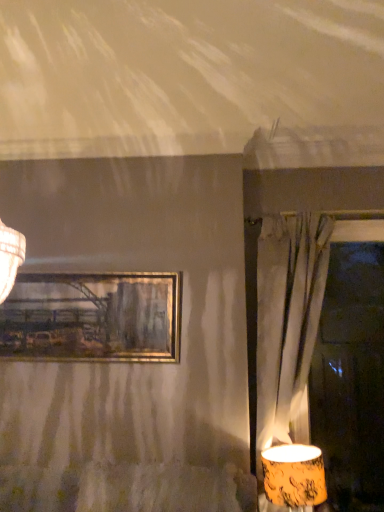
Question: From the image's perspective, is matte orange lampshade at lower right located above or below matte gray curtain at right?

Choices:
 (A) above
 (B) below

Answer: (B)

Question: In the image, is matte orange lampshade at lower right positioned in front of or behind matte gray curtain at right?

Choices:
 (A) front
 (B) behind

Answer: (A)

Question: Which is nearer to the matte orange lampshade at lower right?

Choices:
 (A) gold metallic picture frame at upper center
 (B) matte gray curtain at right

Answer: (B)

Question: Which is nearer to the matte gray curtain at right?

Choices:
 (A) gold metallic picture frame at upper center
 (B) matte orange lampshade at lower right

Answer: (B)